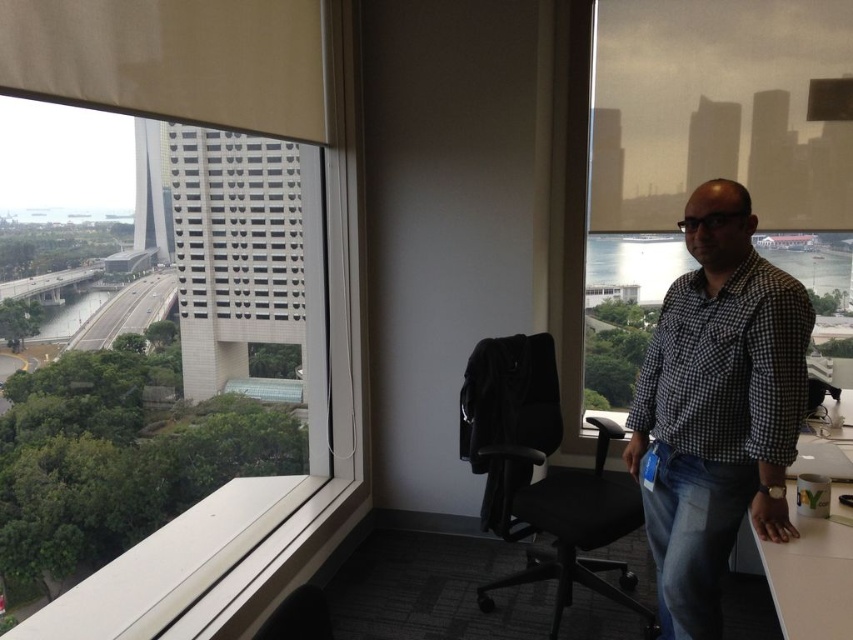
You are an office worker who wants to hang a plant on the transparent glass window at upper left and the transparent glass window at upper right. Considering their heights, which window would allow the plant to be placed higher up?

The transparent glass window at upper left has a greater height compared to transparent glass window at upper right, so the plant can be placed higher up on the transparent glass window at upper left.

You are an office worker who wants to place a 1.2 meter tall potted plant on either the transparent glass window at upper right or the white matte table at lower right. Based on their heights, which location can accommodate the plant without it being taller than the surface?

The transparent glass window at upper right has a greater height compared to white matte table at lower right, so the plant can be placed on the transparent glass window at upper right since it is taller than the white matte table at lower right and can accommodate the 1.2 meter tall potted plant.

You are an office worker who wants to sit down at the white matte table at lower right. Where should you go to find the black fabric swivel chair at center?

The black fabric swivel chair at center is positioned under the white matte table at lower right, so you should go to the area directly beneath the table to find it.